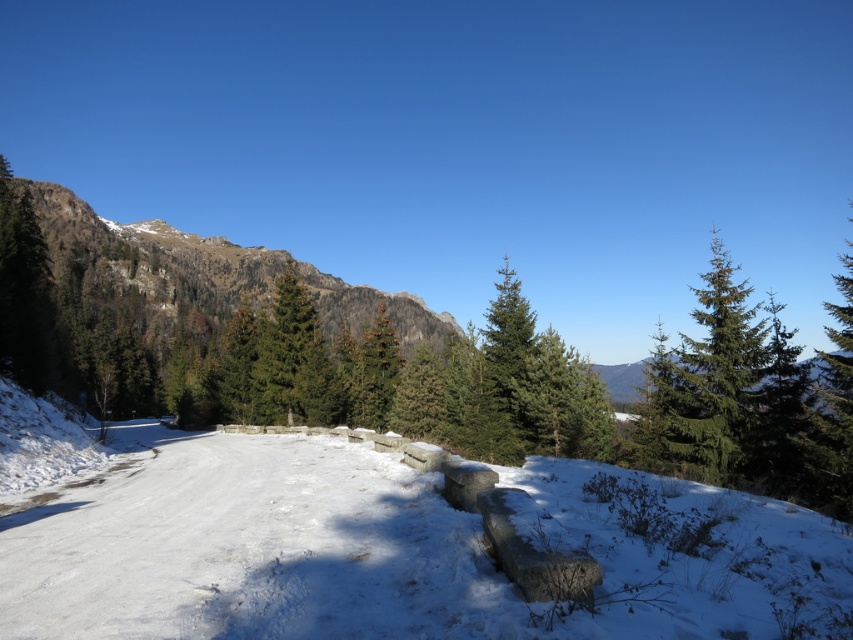
Is point (799, 525) more distant than point (161, 243)?

No, (799, 525) is in front of (161, 243).

Looking at this image, between white snow at center and rugged stone mountain at left, which one is positioned higher?

Positioned higher is rugged stone mountain at left.

Which is behind, point (413, 524) or point (267, 257)?

The point (267, 257) is behind.

Locate an element on the screen. This screenshot has width=853, height=640. white snow at center is located at coordinates (379, 552).

Is point (215, 268) closer to viewer compared to point (520, 355)?

No, (215, 268) is behind (520, 355).

Looking at this image, can you confirm if rugged stone mountain at left is wider than green matte evergreen tree at center?

Indeed, rugged stone mountain at left has a greater width compared to green matte evergreen tree at center.

What are the coordinates of `rugged stone mountain at left` in the screenshot? It's located at (201, 275).

In order to click on rugged stone mountain at left in this screenshot , I will do `click(201, 275)`.

Consider the image. Is white snow at center to the left of green matte evergreen tree at center from the viewer's perspective?

Indeed, white snow at center is positioned on the left side of green matte evergreen tree at center.

Can you confirm if white snow at center is taller than green matte evergreen tree at center?

Incorrect, white snow at center's height is not larger of green matte evergreen tree at center's.

Who is more distant from viewer, (773, 556) or (527, 332)?

Positioned behind is point (527, 332).

This screenshot has height=640, width=853. I want to click on white snow at center, so click(379, 552).